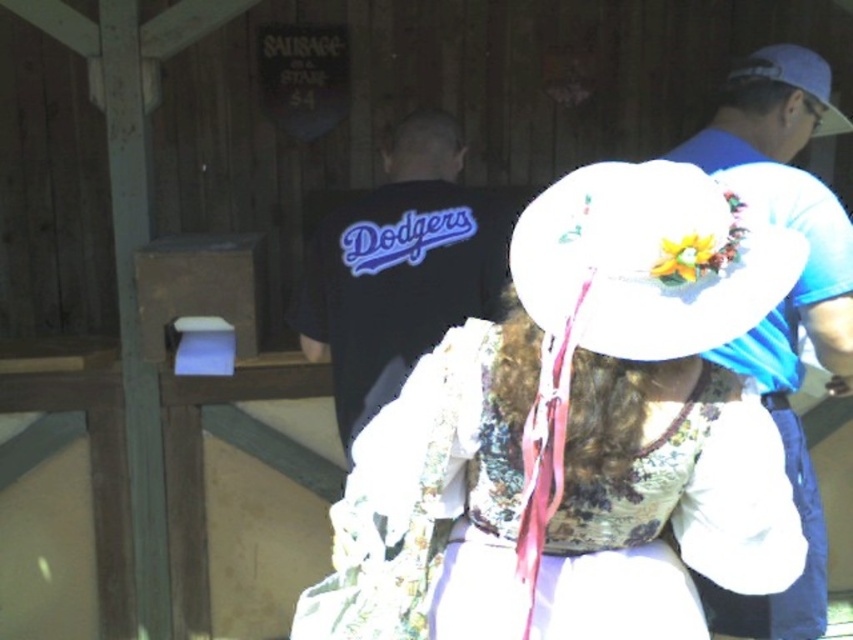
Is point (376, 349) closer to camera compared to point (798, 61)?

No.

Which is more to the left, black fabric dodgers shirt at center or white fabric hat at upper right?

Positioned to the left is black fabric dodgers shirt at center.

Between point (413, 284) and point (788, 76), which one is positioned in front?

Point (788, 76)

At what (x,y) coordinates should I click in order to perform the action: click on black fabric dodgers shirt at center. Please return your answer as a coordinate pair (x, y). This screenshot has width=853, height=640. Looking at the image, I should click on (401, 268).

Who is higher up, white fabric hat at center or white fabric hat at upper right?

white fabric hat at upper right

In the scene shown: Measure the distance between point (675,262) and camera.

Point (675,262) and camera are 3.86 feet apart.

Locate an element on the screen. The height and width of the screenshot is (640, 853). white fabric hat at center is located at coordinates (583, 433).

Can you confirm if white fabric cowboy hat at center is thinner than blue fabric shirt at right?

Indeed, white fabric cowboy hat at center has a lesser width compared to blue fabric shirt at right.

Is white fabric cowboy hat at center smaller than blue fabric shirt at right?

Indeed, white fabric cowboy hat at center has a smaller size compared to blue fabric shirt at right.

Locate an element on the screen. The width and height of the screenshot is (853, 640). white fabric cowboy hat at center is located at coordinates (648, 260).